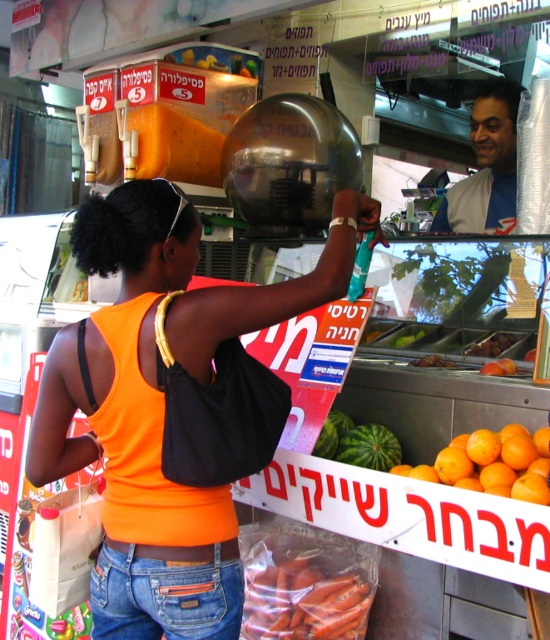
Question: Among these points, which one is farthest from the camera?

Choices:
 (A) (396, 458)
 (B) (129, 483)
 (C) (484, 113)

Answer: (C)

Question: Is orange fabric tank top at center in front of green matte watermelon at lower center?

Choices:
 (A) no
 (B) yes

Answer: (B)

Question: Considering the real-world distances, which object is farthest from the jeans at lower center?

Choices:
 (A) green matte watermelon at lower center
 (B) orange fabric tank top at center
 (C) orange plastic carrots at lower center

Answer: (A)

Question: Can you confirm if orange plastic carrots at lower center is bigger than green matte watermelon at lower center?

Choices:
 (A) yes
 (B) no

Answer: (A)

Question: Which object is farther from the camera taking this photo?

Choices:
 (A) orange plastic carrots at lower center
 (B) smooth plastic face at upper right
 (C) green matte watermelon at lower center
 (D) jeans at lower center

Answer: (B)

Question: Is jeans at lower center to the right of green matte watermelon at lower center from the viewer's perspective?

Choices:
 (A) no
 (B) yes

Answer: (A)